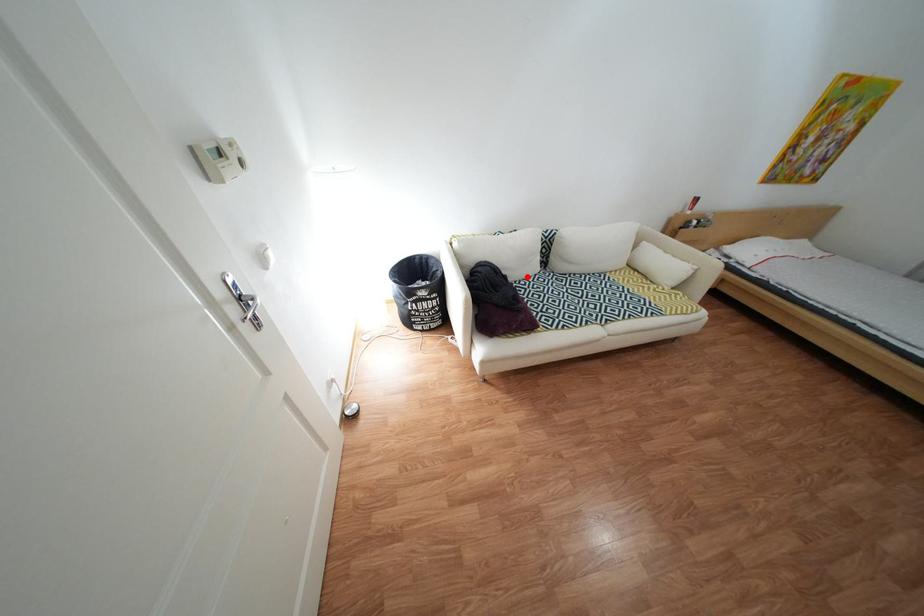
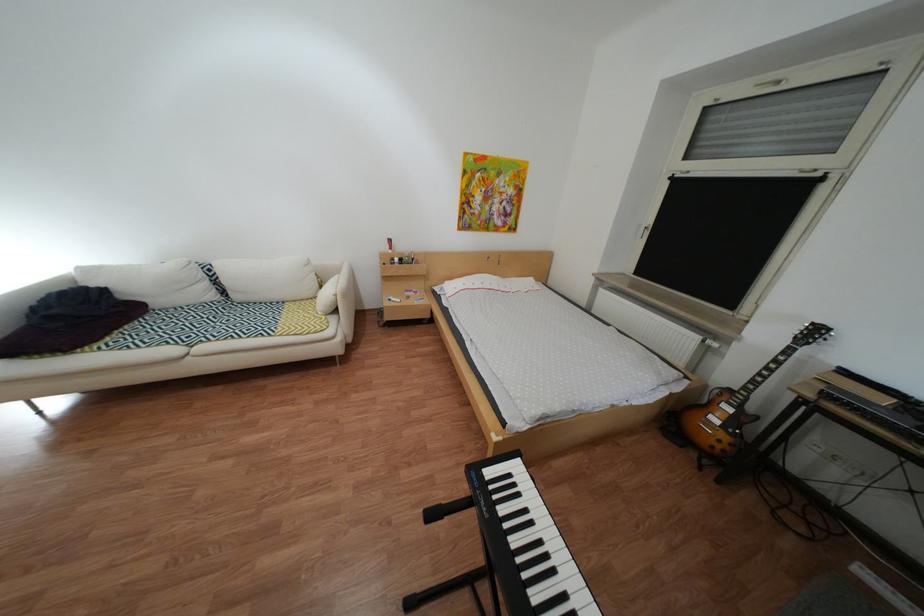
The point at the highlighted location is marked in the first image. Where is the corresponding point in the second image?

(172, 304)